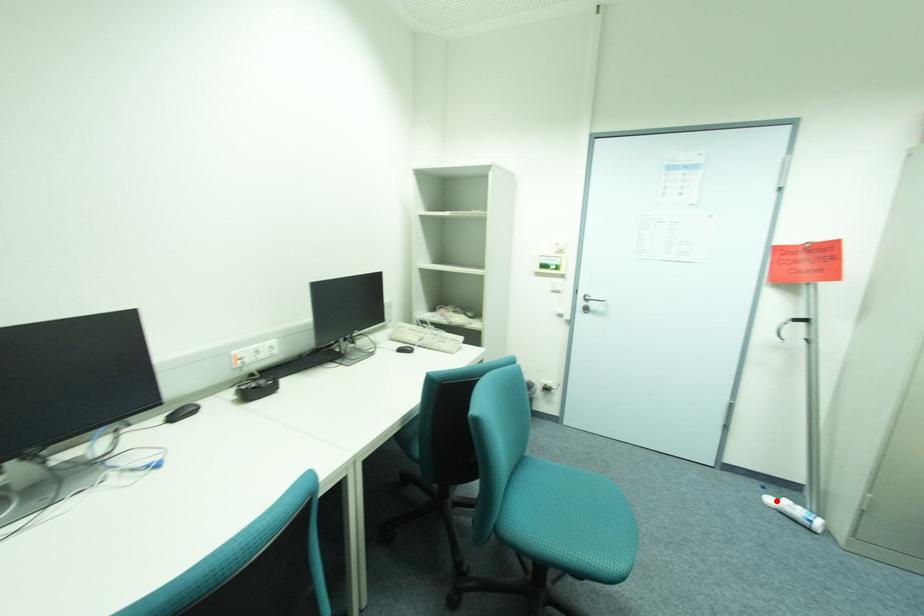
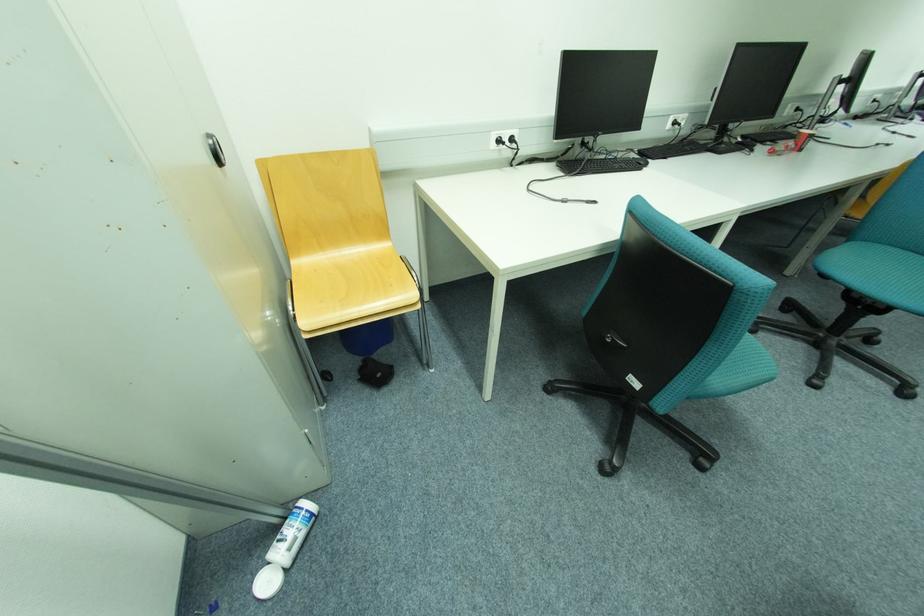
The point at the highlighted location is marked in the first image. Where is the corresponding point in the second image?

(274, 584)